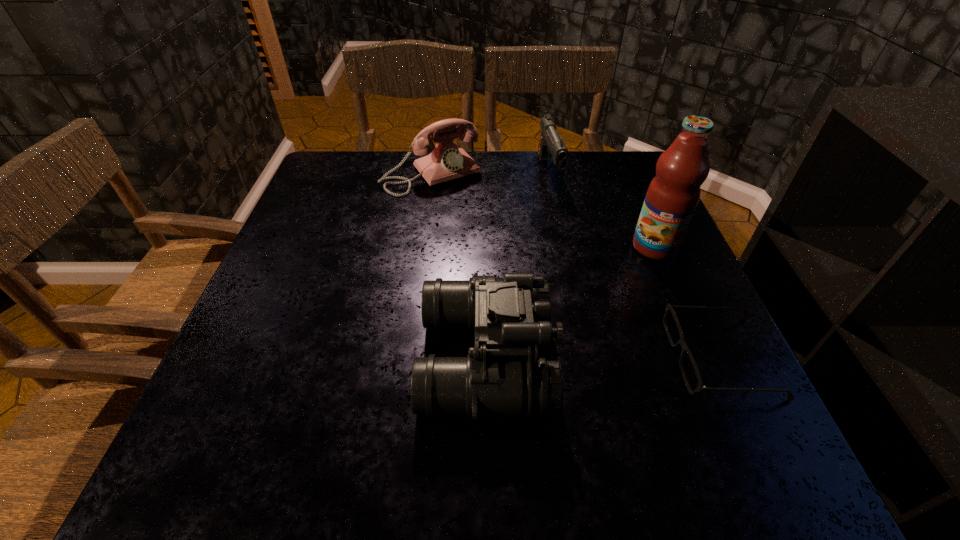
You are a GUI agent. You are given a task and a screenshot of the screen. Output one action in this format:
    pyautogui.click(x=<x>, y=<y>)
    Task: Click on the binoculars
    The width and height of the screenshot is (960, 540).
    Given the screenshot: What is the action you would take?
    pyautogui.click(x=508, y=379)

Find the location of `spectacles`. spectacles is located at coordinates (700, 387).

You are a GUI agent. You are given a task and a screenshot of the screen. Output one action in this format:
    pyautogui.click(x=<x>, y=<y>)
    Task: Click on the telephone
    
    Given the screenshot: What is the action you would take?
    pyautogui.click(x=446, y=161)

This screenshot has width=960, height=540. I want to click on the third nearest object, so click(x=673, y=194).

Where is `fruit juice`? The image size is (960, 540). fruit juice is located at coordinates (673, 194).

Find the location of a particular element. The image size is (960, 540). the third object from left to right is located at coordinates (550, 141).

At what (x,y) coordinates should I click in order to perform the action: click on vacant space located 0.200m through the lenses of the binoculars. Please return your answer as a coordinate pair (x, y). The height and width of the screenshot is (540, 960). Looking at the image, I should click on (661, 359).

Locate an element on the screen. vacant region located 0.130m on the front-facing side of the shortest object is located at coordinates (602, 357).

You are a GUI agent. You are given a task and a screenshot of the screen. Output one action in this format:
    pyautogui.click(x=<x>, y=<y>)
    Task: Click on the vacant space situated 0.140m on the front-facing side of the shortest object
    
    Given the screenshot: What is the action you would take?
    pyautogui.click(x=597, y=357)

Identify the location of free space located 0.310m on the front-facing side of the shortest object. The width and height of the screenshot is (960, 540). (502, 357).